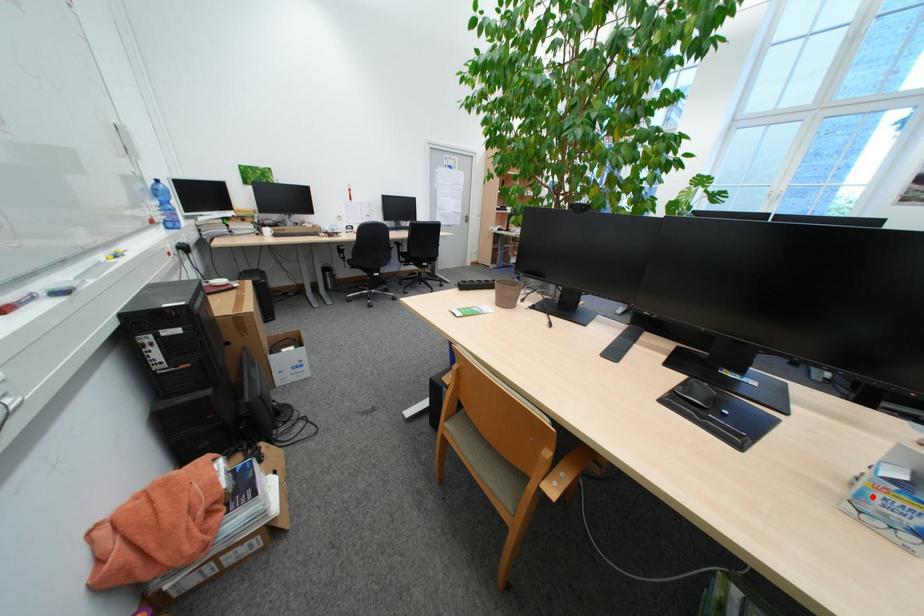
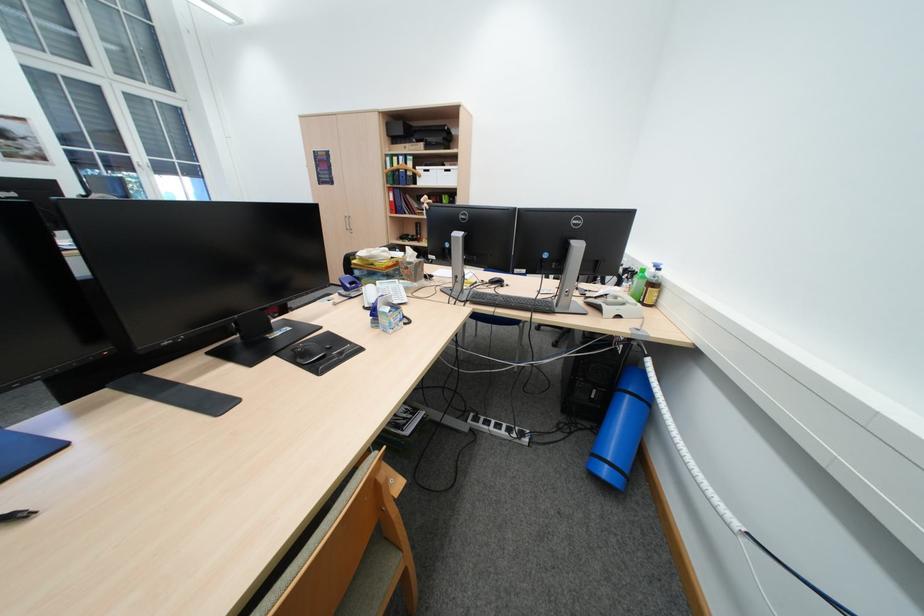
Find the pixel in the second image that matches the highlighted location in the first image.

(402, 325)